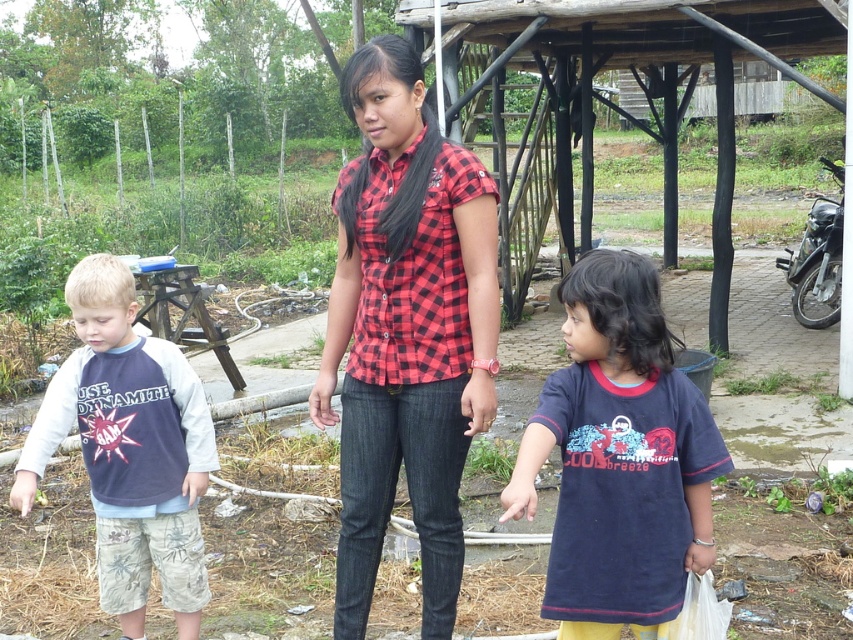
You are a photographer trying to capture a group photo of the red checkered shirt at center and the dark blue jersey at left. Since you want both subjects to be fully visible in the frame, should you adjust your camera angle upwards or downwards?

The red checkered shirt at center is above the dark blue jersey at left, so to ensure both are fully visible in the frame, you should adjust your camera angle downwards.